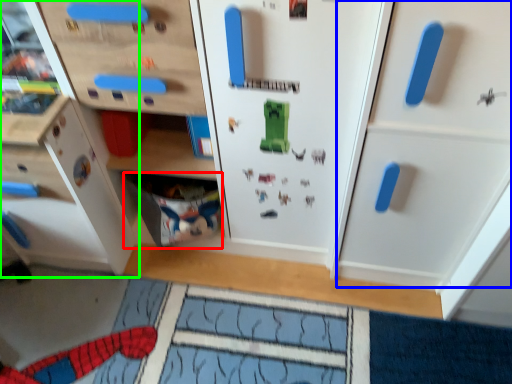
Question: Which is farther away from drawer (highlighted by a red box)? cabinetry (highlighted by a blue box) or cabinetry (highlighted by a green box)?

Choices:
 (A) cabinetry
 (B) cabinetry

Answer: (A)